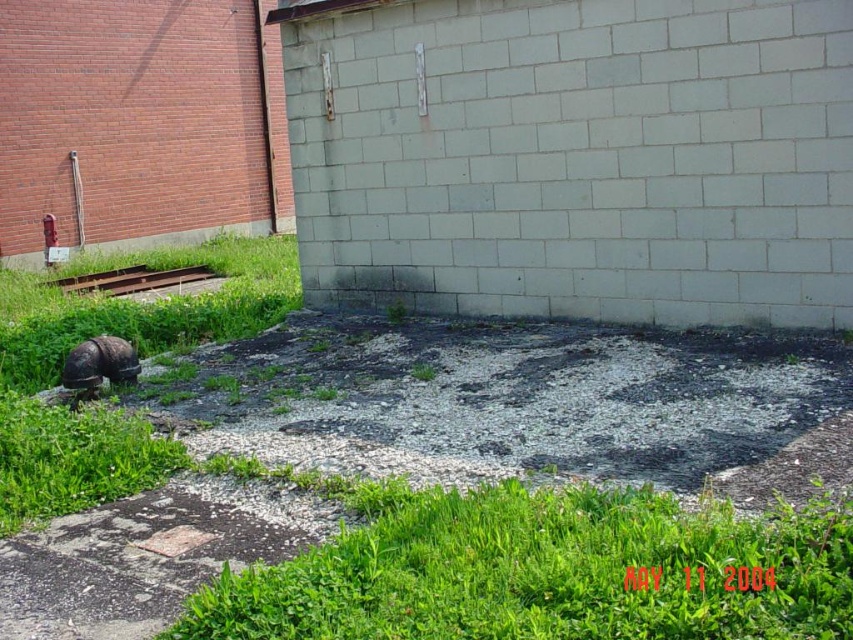
Where is `green leafy grass at lower center`? This screenshot has height=640, width=853. green leafy grass at lower center is located at coordinates (544, 570).

Which is below, green leafy grass at lower center or smooth concrete patch at lower left?

smooth concrete patch at lower left

Locate an element on the screen. The height and width of the screenshot is (640, 853). green leafy grass at lower center is located at coordinates (544, 570).

Identify the location of green leafy grass at lower center. (544, 570).